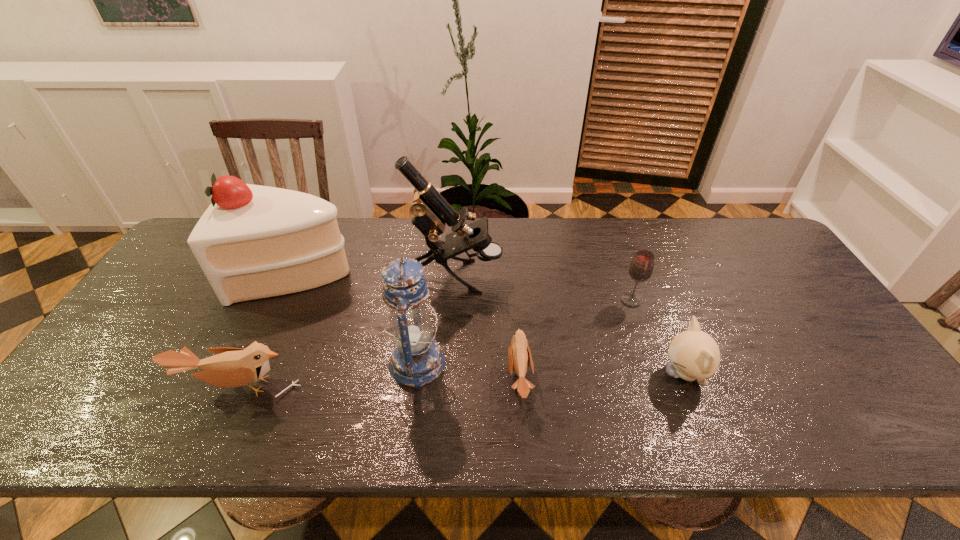
Where is `vacant point located between the cake and the lantern`? vacant point located between the cake and the lantern is located at coordinates (357, 318).

You are a GUI agent. You are given a task and a screenshot of the screen. Output one action in this format:
    pyautogui.click(x=<x>, y=<y>)
    Task: Click on the vacant space in between the kitten and the microscope
    
    Given the screenshot: What is the action you would take?
    pyautogui.click(x=570, y=325)

The height and width of the screenshot is (540, 960). In order to click on vacant point located between the lantern and the left bird in this screenshot , I will do `click(327, 375)`.

You are a GUI agent. You are given a task and a screenshot of the screen. Output one action in this format:
    pyautogui.click(x=<x>, y=<y>)
    Task: Click on the free space between the cake and the microscope
    This screenshot has height=540, width=960.
    Given the screenshot: What is the action you would take?
    pyautogui.click(x=376, y=274)

Find the location of `free area in between the kitten and the microscope`. free area in between the kitten and the microscope is located at coordinates (570, 325).

Find the location of a particular element. This screenshot has height=540, width=960. vacant point located between the taller bird and the kitten is located at coordinates (461, 380).

In order to click on the second closest object to the third object from right to left in this screenshot , I will do (x=431, y=211).

Locate which object is the closest to the right bird. Please provide its 2D coordinates. Your answer should be formatted as a tuple, i.e. [(x, y)], where the tuple contains the x and y coordinates of a point satisfying the conditions above.

[(416, 360)]

You are a GUI agent. You are given a task and a screenshot of the screen. Output one action in this format:
    pyautogui.click(x=<x>, y=<y>)
    Task: Click on the blank space that satisfies the following two spatial constraints: 1. on the front side of the glass drink container; 2. on the left side of the cake
    The width and height of the screenshot is (960, 540).
    Given the screenshot: What is the action you would take?
    pyautogui.click(x=284, y=300)

Locate an element on the screen. The image size is (960, 540). vacant space that satisfies the following two spatial constraints: 1. through the eyepiece of the microscope; 2. on the right side of the glass drink container is located at coordinates (454, 300).